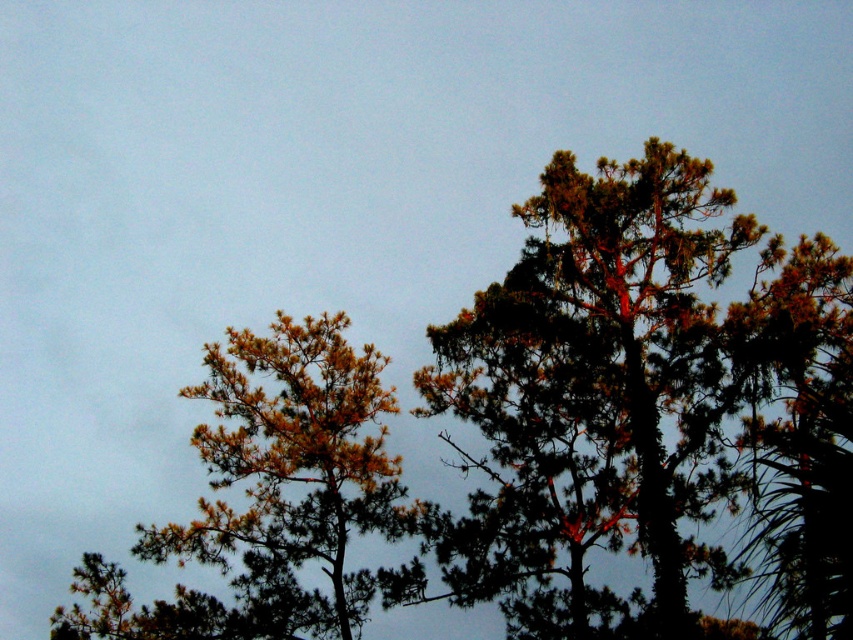
Question: Is dark green textured tree at upper right in front of dull yellow-green needles at left?

Choices:
 (A) no
 (B) yes

Answer: (B)

Question: Which of these objects is positioned farthest from the dull yellow-green needles at left?

Choices:
 (A) green needle-like at upper right
 (B) dark green textured tree at upper right

Answer: (A)

Question: Does dull yellow-green needles at left have a larger size compared to green needle-like at upper right?

Choices:
 (A) no
 (B) yes

Answer: (A)

Question: Which of the following is the farthest from the observer?

Choices:
 (A) dull yellow-green needles at left
 (B) green needle-like at upper right
 (C) dark green textured tree at upper right

Answer: (A)

Question: Which point appears closest to the camera in this image?

Choices:
 (A) (786, 632)
 (B) (192, 536)
 (C) (788, 449)

Answer: (C)

Question: Is dull yellow-green needles at left positioned behind green needle-like at upper right?

Choices:
 (A) no
 (B) yes

Answer: (B)